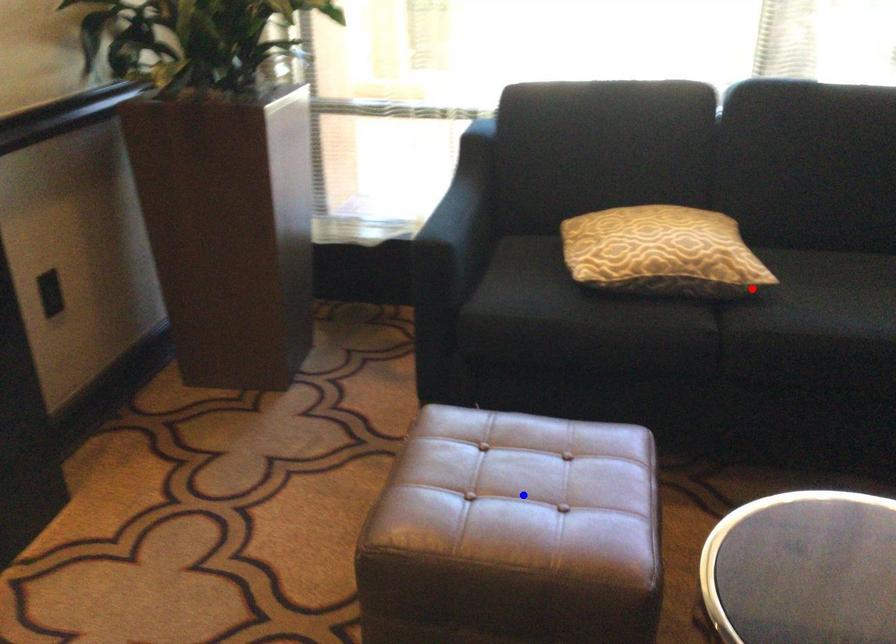
Question: In the image, two points are highlighted. Which point is nearer to the camera? Reply with the corresponding letter.

Choices:
 (A) blue point
 (B) red point

Answer: (A)